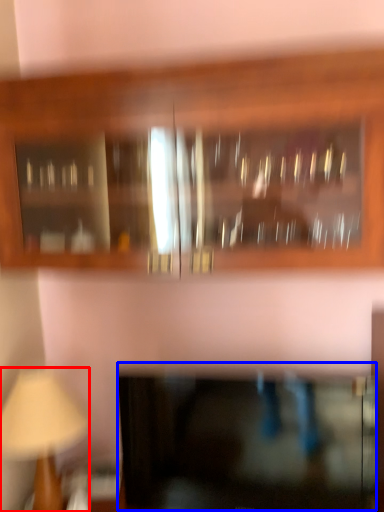
Question: Which of the following is the farthest to the observer, table lamp (highlighted by a red box) or cabinetry (highlighted by a blue box)?

Choices:
 (A) table lamp
 (B) cabinetry

Answer: (A)